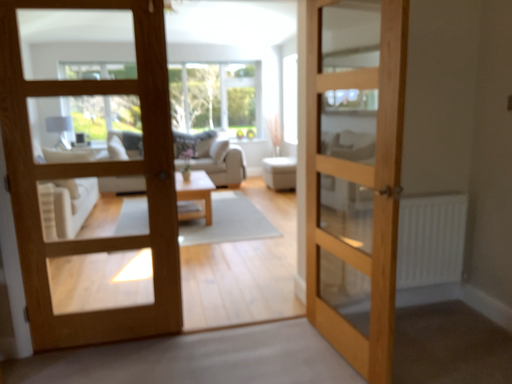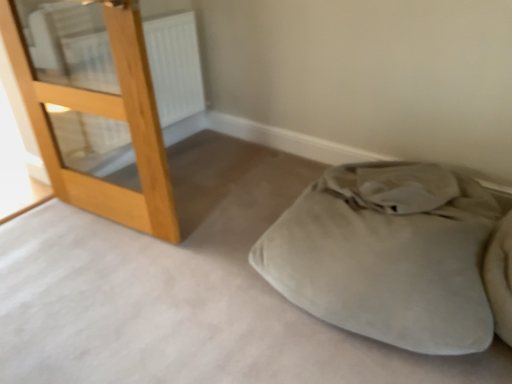
Question: Which way did the camera rotate in the video?

Choices:
 (A) rotated left
 (B) rotated right

Answer: (B)